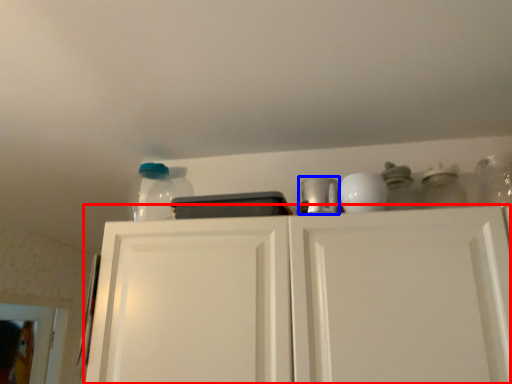
Question: Which object is closer to the camera taking this photo, cabinetry (highlighted by a red box) or appliance (highlighted by a blue box)?

Choices:
 (A) cabinetry
 (B) appliance

Answer: (A)